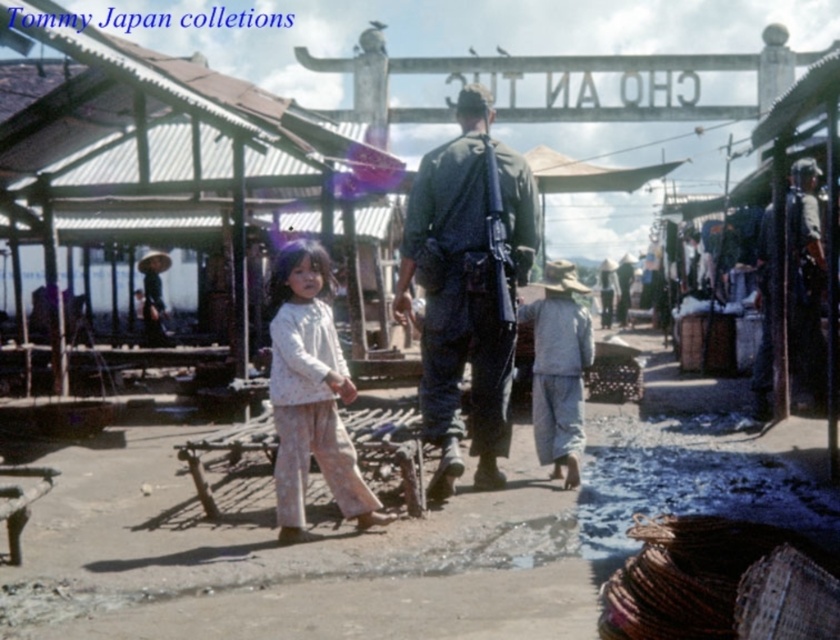
You are a photographer trying to capture both the dark green uniform at center and the white floral dress at center in a single shot. Which one should you focus on first to ensure both are in focus?

The dark green uniform at center is closer to you than the white floral dress at center, so focus on the dark green uniform at center first to ensure both are in focus.

You are standing at the market entrance and want to reach the point marked at coordinates (516,218). If your walking speed is 3 feet per second, how many seconds will it take you to reach that point?

The distance of point (516,218) from viewer is 23.20 feet. At a speed of 3 feet per second, it will take approximately 7.73 seconds to reach the point.